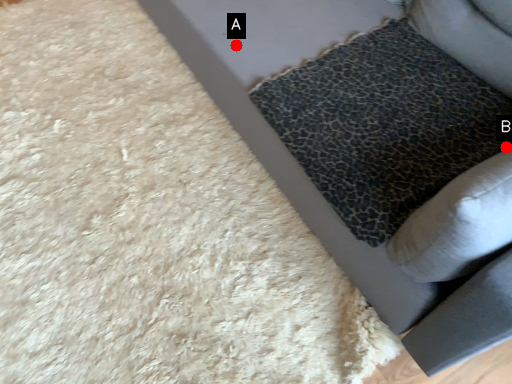
Question: Two points are circled on the image, labeled by A and B beside each circle. Among these points, which one is farthest from the camera?

Choices:
 (A) A is further
 (B) B is further

Answer: (A)